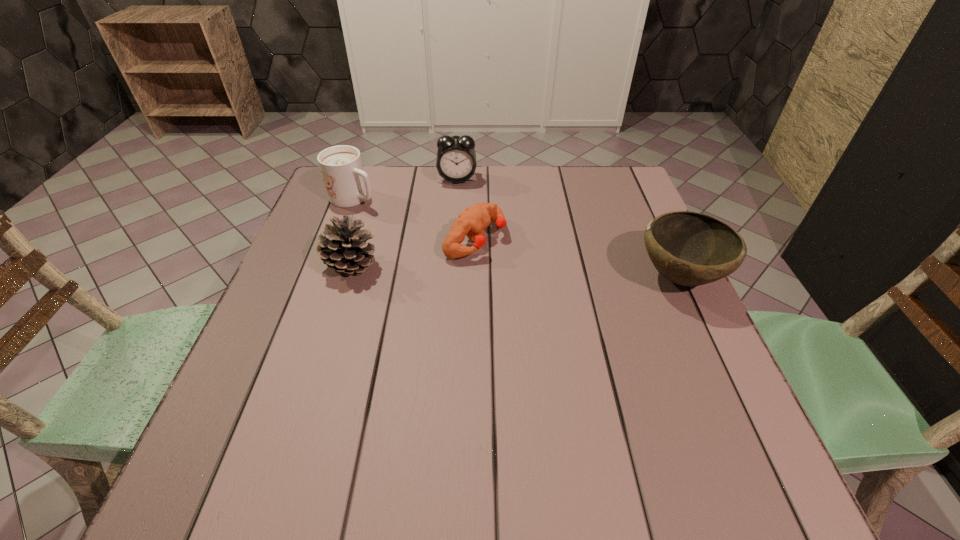
This screenshot has height=540, width=960. In order to click on pinecone in this screenshot , I will do `click(343, 248)`.

Identify the location of the rightmost object. The width and height of the screenshot is (960, 540). (687, 248).

Identify the location of alarm clock. The height and width of the screenshot is (540, 960). tap(456, 162).

Locate an element on the screen. This screenshot has height=540, width=960. the shortest object is located at coordinates tap(471, 223).

The height and width of the screenshot is (540, 960). Find the location of `cappuccino`. cappuccino is located at coordinates (347, 184).

Where is `free space located 0.380m on the back of the pinecone`? Image resolution: width=960 pixels, height=540 pixels. free space located 0.380m on the back of the pinecone is located at coordinates (380, 169).

Where is `vacant space positioned 0.130m on the front of the bowl`? vacant space positioned 0.130m on the front of the bowl is located at coordinates (717, 360).

Locate an element on the screen. This screenshot has height=540, width=960. blank space located 0.400m on the front side of the alarm clock is located at coordinates (467, 280).

You are a GUI agent. You are given a task and a screenshot of the screen. Output one action in this format:
    pyautogui.click(x=<x>, y=<y>)
    Task: Click on the free region located on the front side of the alarm clock
    The height and width of the screenshot is (540, 960).
    Given the screenshot: What is the action you would take?
    pyautogui.click(x=460, y=205)

You are a GUI agent. You are given a task and a screenshot of the screen. Output one action in this format:
    pyautogui.click(x=<x>, y=<y>)
    Task: Click on the free region located 0.370m on the front side of the alarm clock
    The height and width of the screenshot is (540, 960).
    Given the screenshot: What is the action you would take?
    pyautogui.click(x=466, y=271)